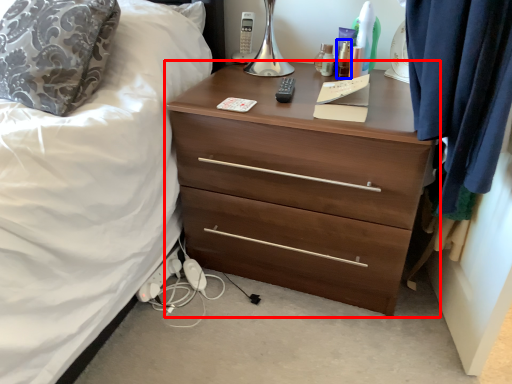
Question: Which object is further to the camera taking this photo, chest of drawers (highlighted by a red box) or toiletry (highlighted by a blue box)?

Choices:
 (A) chest of drawers
 (B) toiletry

Answer: (B)